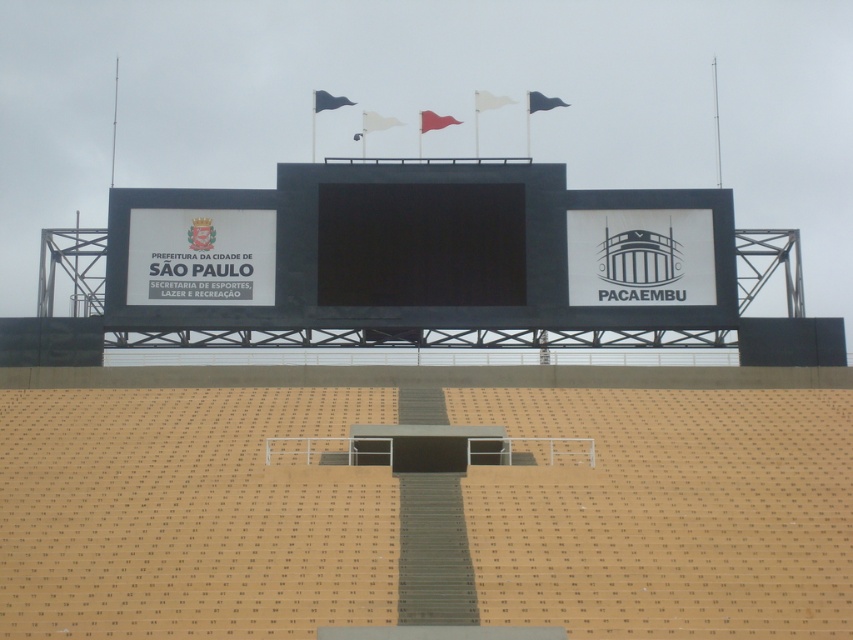
You are standing in the stadium looking at the scoreboard. There are two points marked on the scoreboard at coordinates point (442,170) and point (347,100). Which point is closer to you?

Point (442,170) is closer to the viewer than point (347,100).

You are attending a sports event at the stadium and notice two flags displayed above the scoreboard. The white fabric flag at upper center and the blue fabric flag at upper center. Which flag is shorter?

The white fabric flag at upper center is shorter than the blue fabric flag at upper center.

You are standing at the base of the stadium bleachers and want to take a photo of the point located at coordinates point (491, 108). The stadium has a rule that you must maintain a minimum distance of 120 meters from any scoreboard components. Will your current position allow you to comply with this rule?

The distance of point (491, 108) from camera is 123.18 meters, so yes, your current position at the base of the stadium bleachers is 123.18 meters away from the point (491, 108), which exceeds the required minimum distance of 120 meters. You can take the photo while complying with the rule.